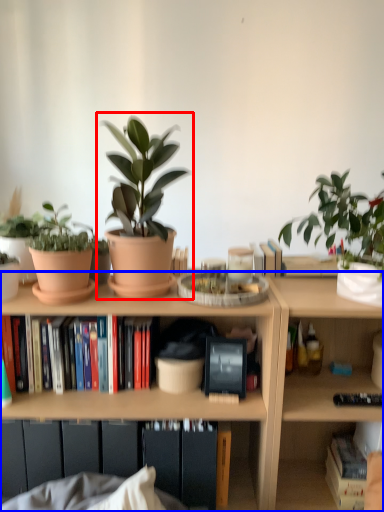
Question: Which object appears closest to the camera in this image, houseplant (highlighted by a red box) or bookcase (highlighted by a blue box)?

Choices:
 (A) houseplant
 (B) bookcase

Answer: (A)